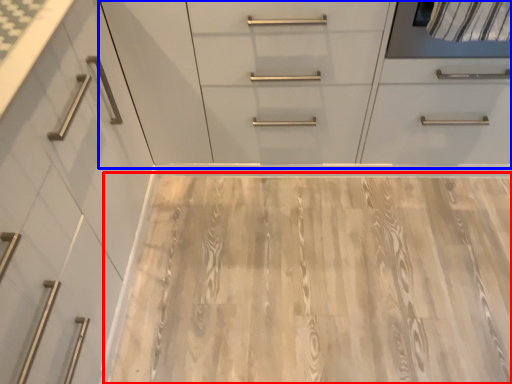
Question: Among these objects, which one is nearest to the camera, plywood (highlighted by a red box) or dresser (highlighted by a blue box)?

Choices:
 (A) plywood
 (B) dresser

Answer: (B)